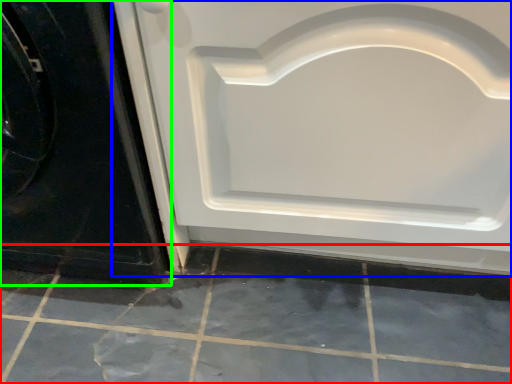
Question: Based on their relative distances, which object is nearer to ceramic tile (highlighted by a red box)? Choose from door (highlighted by a blue box) and door (highlighted by a green box).

Choices:
 (A) door
 (B) door

Answer: (A)